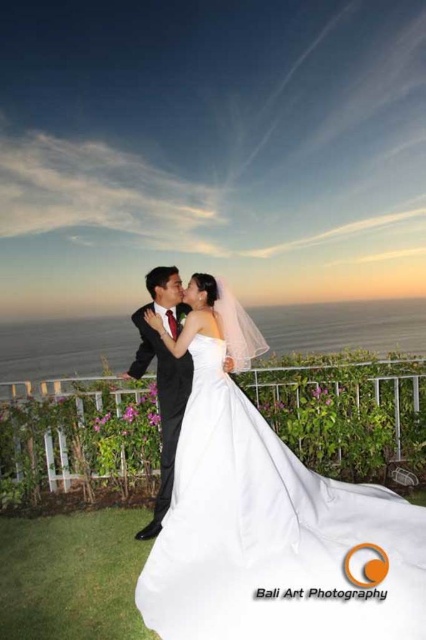
You are a photographer capturing the wedding scene from the camera position. You want to focus on the point that is closer to you. Which point should you choose between point (184, 518) and point (158, 528)?

Point (184, 518) is closer to the camera than point (158, 528), so you should choose point (184, 518) to focus on.

You are a photographer positioned at the origin point in the scene. The white satin dress at center is located at coordinates point 0.838, 0.643. If you want to capture the dress in the center of your frame, should you adjust your camera to the left or right?

The white satin dress at center is already positioned at point (x=273, y=536), which is the center of the frame. Therefore, no adjustment is needed to center it in the camera view.